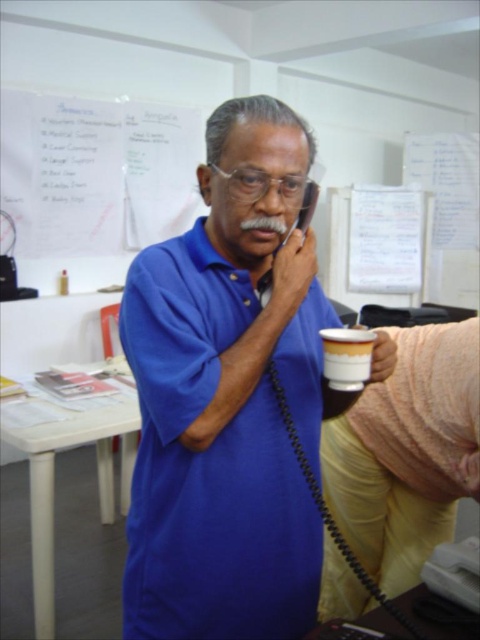
You are standing in the office scene and want to know which of the two points, point (196, 300) or point (359, 368), is closer to you. Can you determine this based on their positions?

Point (196, 300) is further to the camera than point (359, 368), so the point closer to you is point (359, 368).

You are an office assistant who needs to place a new mug on the table where the blue matte shirt at center and white matte cup at center are located. According to the current arrangement, where should you place the new mug so it doesn

The blue matte shirt at center is to the left of the white matte cup at center, so you should place the new mug to the right of the white matte cup at center to maintain the existing arrangement.

You are an interior designer planning to place a decorative item on the table where the blue matte shirt at center and the white matte cup at center are located. Considering their positions, which object should you avoid placing the item near to ensure it doesn,t fall off?

You should avoid placing the item near the blue matte shirt at center because it might be wider and could potentially knock over the decorative item.